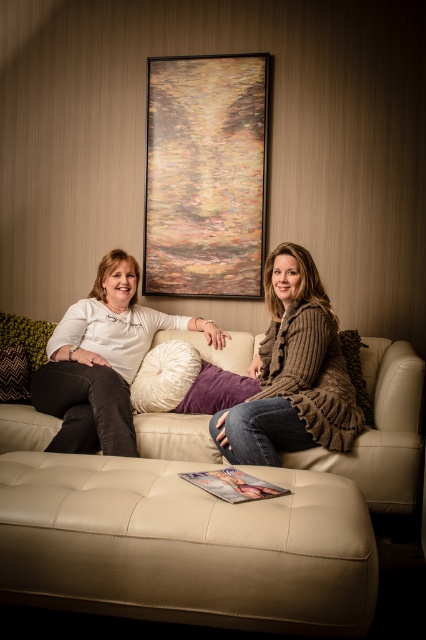
You are a photographer setting up a shoot in this living room. You need to place a small prop between the leather ottoman at center and the matte white shirt at center so that it is visible in the photo. Where should you place the prop to ensure it is in front of both objects?

The leather ottoman at center is closer to the viewer than the matte white shirt at center. To ensure the prop is visible in front of both, place it on the leather ottoman at center so it sits between the ottoman and the shirt, making sure it is positioned where it can be seen in front of both objects.

You are a guest entering the living room and want to sit on the beige leather couch at center. However, there is a leather ottoman at center in the way. Can you move around it to reach the couch?

The leather ottoman at center is in front of the beige leather couch at center, so you can move around it to reach the couch since it is positioned in front and not blocking all access paths.

From the picture: You are standing in the room and want to place a small plant on the leather ottoman at center. Can you confirm the exact coordinates where you should place the plant?

The leather ottoman at center is located at coordinates point (187,545), so you should place the small plant there.